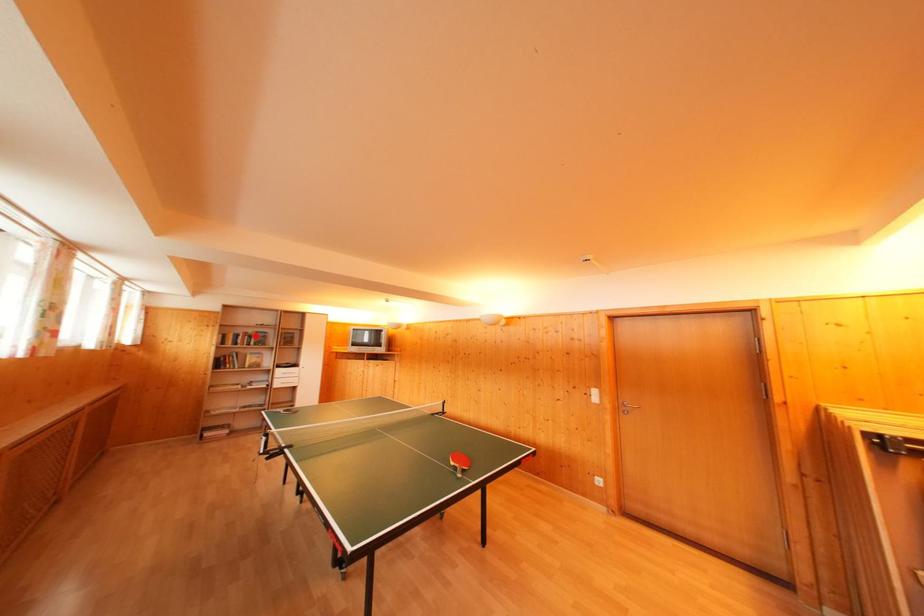
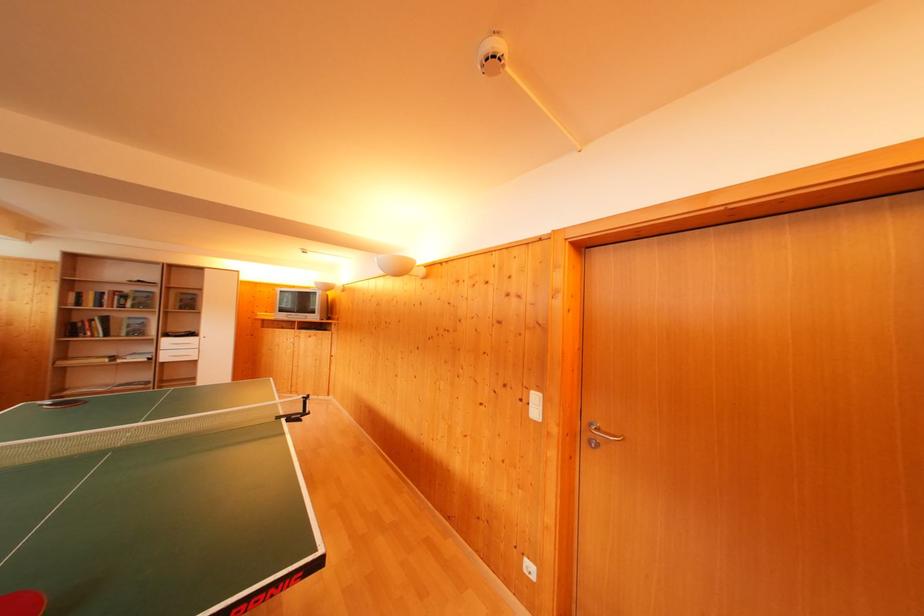
Question: I am providing you with two images of the same scene from different viewpoints. A red point is marked on the first image. Is the red point's position out of view in image 2?

Choices:
 (A) Yes
 (B) No

Answer: (B)